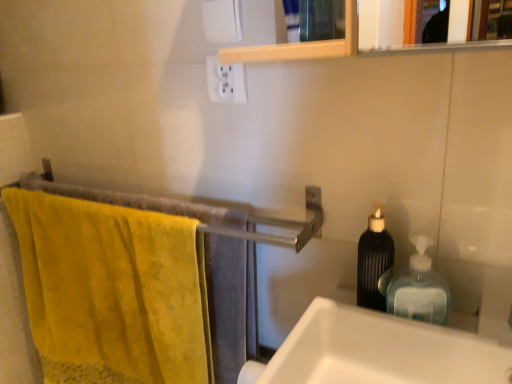
Question: Considering the relative positions of white glossy sink at right and black textured bottle at right, the 2th bottle from the right, in the image provided, is white glossy sink at right behind black textured bottle at right, the 2th bottle from the right,?

Choices:
 (A) yes
 (B) no

Answer: (B)

Question: Does white glossy sink at right appear on the right side of black textured bottle at right, the 1th bottle positioned from the left?

Choices:
 (A) no
 (B) yes

Answer: (B)

Question: Is black textured bottle at right, the 2th bottle from the right, surrounded by white glossy sink at right?

Choices:
 (A) no
 (B) yes

Answer: (A)

Question: Can we say white glossy sink at right lies outside black textured bottle at right, the 2th bottle from the right?

Choices:
 (A) yes
 (B) no

Answer: (A)

Question: Is white glossy sink at right positioned with its back to black textured bottle at right, the 1th bottle positioned from the left?

Choices:
 (A) yes
 (B) no

Answer: (B)

Question: From the image's perspective, is white glossy sink at right below black textured bottle at right, the 1th bottle positioned from the left?

Choices:
 (A) no
 (B) yes

Answer: (B)

Question: Is white glossy sink at right to the left of white plastic outlet at upper center from the viewer's perspective?

Choices:
 (A) yes
 (B) no

Answer: (B)

Question: From the image's perspective, is white glossy sink at right beneath white plastic outlet at upper center?

Choices:
 (A) yes
 (B) no

Answer: (A)

Question: From a real-world perspective, is white glossy sink at right below white plastic outlet at upper center?

Choices:
 (A) no
 (B) yes

Answer: (B)

Question: Is white glossy sink at right not near white plastic outlet at upper center?

Choices:
 (A) no
 (B) yes

Answer: (A)

Question: Does white glossy sink at right have a lesser height compared to white plastic outlet at upper center?

Choices:
 (A) yes
 (B) no

Answer: (B)

Question: Can you confirm if white glossy sink at right is positioned to the right of white plastic outlet at upper center?

Choices:
 (A) yes
 (B) no

Answer: (A)

Question: Considering the relative sizes of yellow cotton towel at left and translucent plastic soap dispenser at right, placed as the 2th bottle when sorted from left to right, in the image provided, is yellow cotton towel at left taller than translucent plastic soap dispenser at right, placed as the 2th bottle when sorted from left to right,?

Choices:
 (A) no
 (B) yes

Answer: (B)